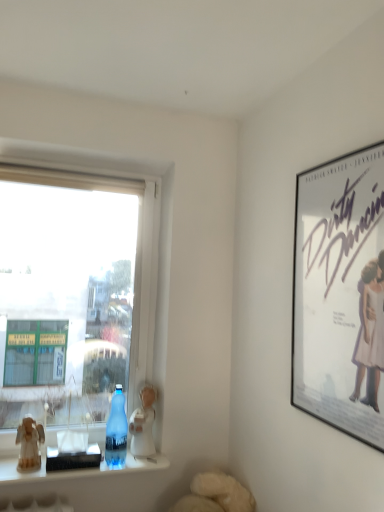
Identify the location of free space above transparent glass window at left (from a real-world perspective). (82, 156).